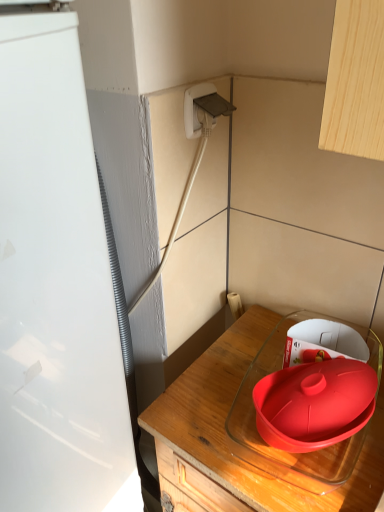
Question: Is white plastic plug at upper center at the left side of transparent glass container at lower right?

Choices:
 (A) no
 (B) yes

Answer: (B)

Question: Considering the relative sizes of white plastic plug at upper center and transparent glass container at lower right in the image provided, is white plastic plug at upper center shorter than transparent glass container at lower right?

Choices:
 (A) yes
 (B) no

Answer: (A)

Question: From a real-world perspective, does white plastic plug at upper center stand above transparent glass container at lower right?

Choices:
 (A) no
 (B) yes

Answer: (B)

Question: Does white plastic plug at upper center have a greater width compared to transparent glass container at lower right?

Choices:
 (A) yes
 (B) no

Answer: (B)

Question: Is white plastic plug at upper center not inside transparent glass container at lower right?

Choices:
 (A) yes
 (B) no

Answer: (A)

Question: Is point (190, 122) positioned closer to the camera than point (362, 488)?

Choices:
 (A) closer
 (B) farther

Answer: (B)

Question: In terms of width, does white plastic plug at upper center look wider or thinner when compared to transparent glass container at lower right?

Choices:
 (A) wide
 (B) thin

Answer: (B)

Question: In terms of size, does white plastic plug at upper center appear bigger or smaller than transparent glass container at lower right?

Choices:
 (A) small
 (B) big

Answer: (A)

Question: In terms of height, does white plastic plug at upper center look taller or shorter compared to transparent glass container at lower right?

Choices:
 (A) tall
 (B) short

Answer: (B)

Question: Considering their positions, is white glossy refrigerator at left located in front of or behind transparent glass container at lower right?

Choices:
 (A) behind
 (B) front

Answer: (B)

Question: Would you say white glossy refrigerator at left is to the left or to the right of transparent glass container at lower right in the picture?

Choices:
 (A) left
 (B) right

Answer: (A)

Question: Does point (38, 138) appear closer or farther from the camera than point (264, 482)?

Choices:
 (A) farther
 (B) closer

Answer: (B)

Question: Is white glossy refrigerator at left bigger or smaller than transparent glass container at lower right?

Choices:
 (A) big
 (B) small

Answer: (B)

Question: In the image, is white glossy refrigerator at left on the left side or the right side of white plastic plug at upper center?

Choices:
 (A) left
 (B) right

Answer: (A)

Question: From a real-world perspective, is white glossy refrigerator at left above or below white plastic plug at upper center?

Choices:
 (A) below
 (B) above

Answer: (A)